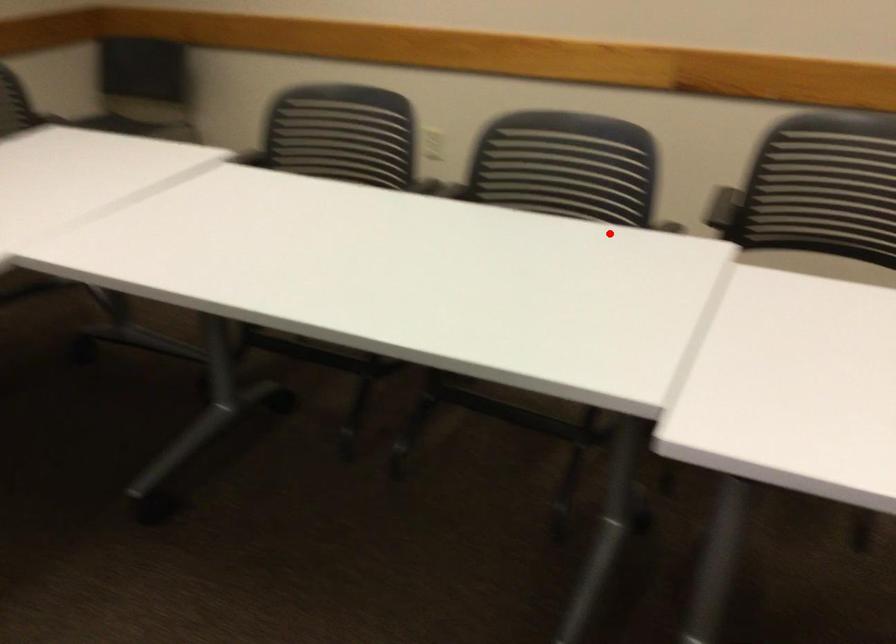
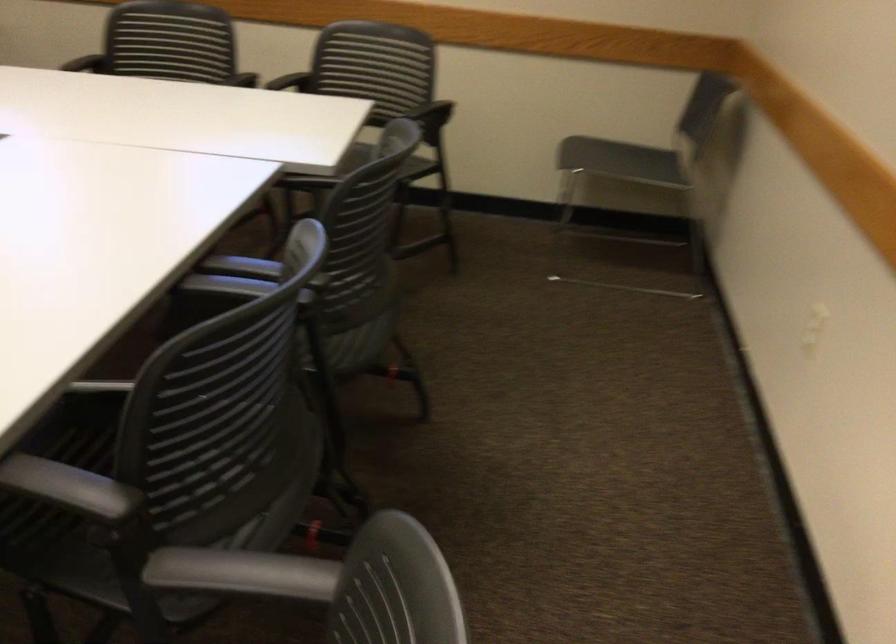
Question: I am providing you with two images of the same scene from different viewpoints. In image1, a red point is highlighted. Considering the same 3D point in image2, which of the following is correct?

Choices:
 (A) It is closer
 (B) It is farther

Answer: (A)